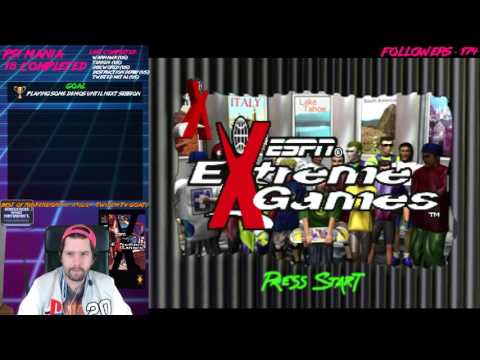
Locate an element on the screen. Image resolution: width=480 pixels, height=360 pixels. windows is located at coordinates (430, 120), (393, 119), (310, 121), (245, 106).